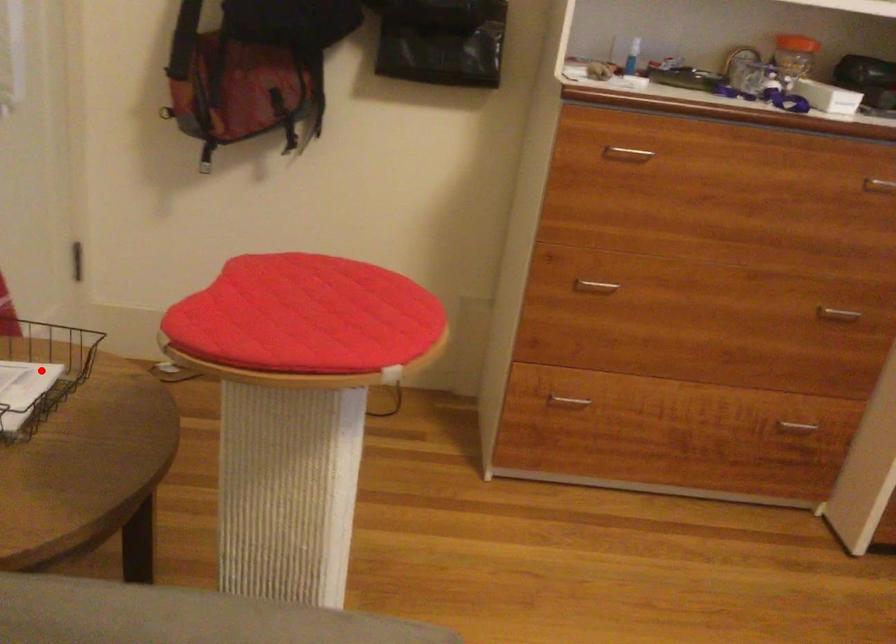
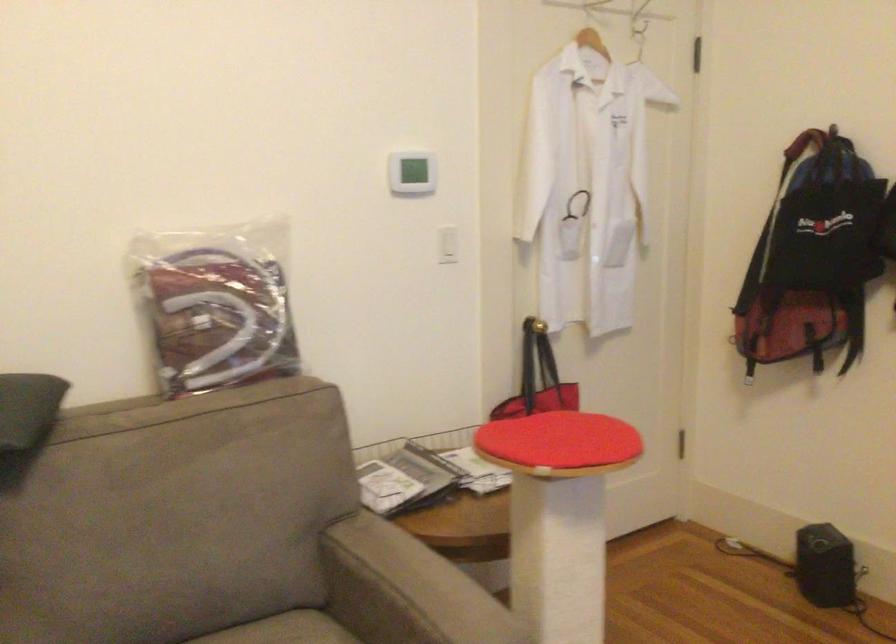
Question: I am providing you with two images of the same scene from different viewpoints. A red point is marked on the first image. Is the red point's position out of view in image 2?

Choices:
 (A) Yes
 (B) No

Answer: (A)